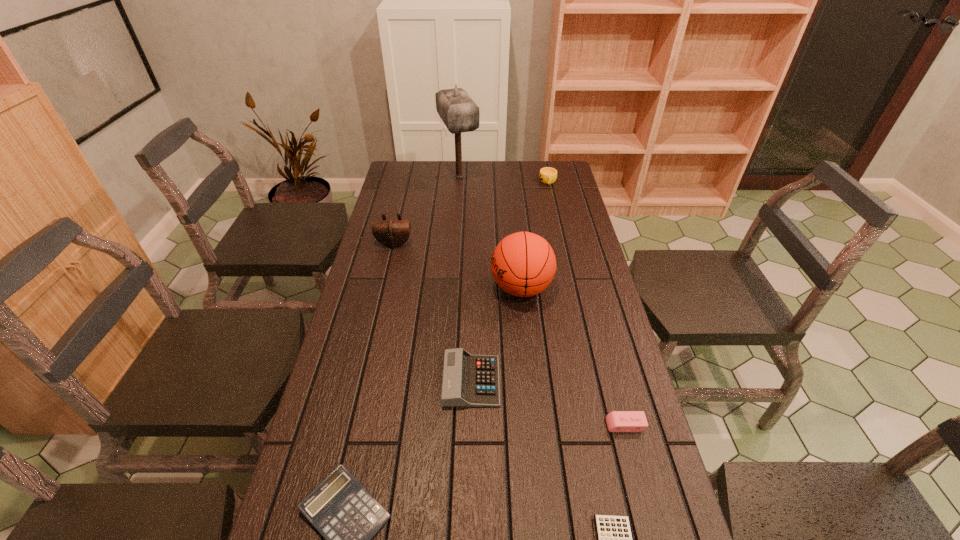
This screenshot has height=540, width=960. Find the location of `basketball at the right edge`. basketball at the right edge is located at coordinates (523, 264).

Where is `cup positioned at the right edge`? cup positioned at the right edge is located at coordinates (547, 175).

Identify the location of eraser present at the right edge. The width and height of the screenshot is (960, 540). (617, 421).

Locate an element on the screen. object that is at the far right corner is located at coordinates (547, 175).

What are the coordinates of `free space at the far edge` in the screenshot? It's located at (442, 173).

This screenshot has width=960, height=540. What are the coordinates of `free point at the left edge` in the screenshot? It's located at (363, 266).

This screenshot has width=960, height=540. In the image, there is a desktop. Find the location of `vacant space at the right edge`. vacant space at the right edge is located at coordinates (598, 295).

Identify the location of free space at the far left corner of the desktop. (393, 181).

Identify the location of vacant area at the far right corner of the desktop. Image resolution: width=960 pixels, height=540 pixels. (561, 186).

The image size is (960, 540). Identify the location of unoccupied area between the pouch and the fifth farthest object. (433, 313).